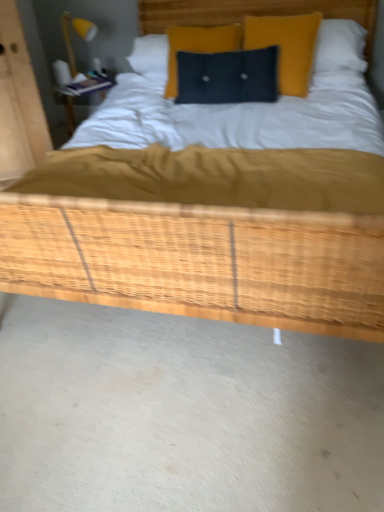
The width and height of the screenshot is (384, 512). What do you see at coordinates (77, 33) in the screenshot? I see `yellow matte table lamp at upper left` at bounding box center [77, 33].

From the picture: Measure the distance between yellow matte table lamp at upper left and camera.

yellow matte table lamp at upper left is 2.57 meters from camera.

Where is `yellow matte table lamp at upper left`? The height and width of the screenshot is (512, 384). yellow matte table lamp at upper left is located at coordinates (77, 33).

This screenshot has height=512, width=384. Find the location of `yellow matte table lamp at upper left`. yellow matte table lamp at upper left is located at coordinates (77, 33).